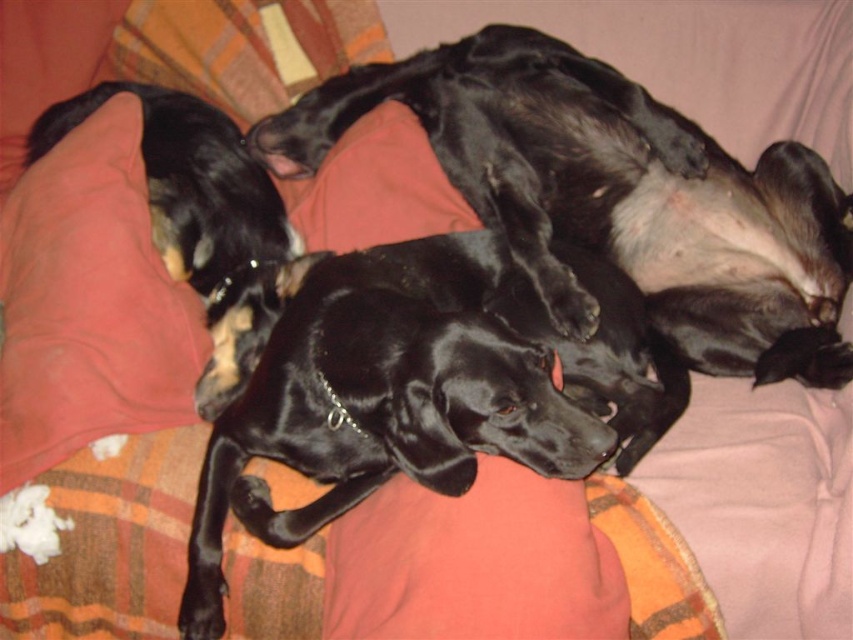
Is black shiny dog at center above cotton pillow at left?

Yes, black shiny dog at center is above cotton pillow at left.

Locate an element on the screen. black shiny dog at center is located at coordinates (612, 193).